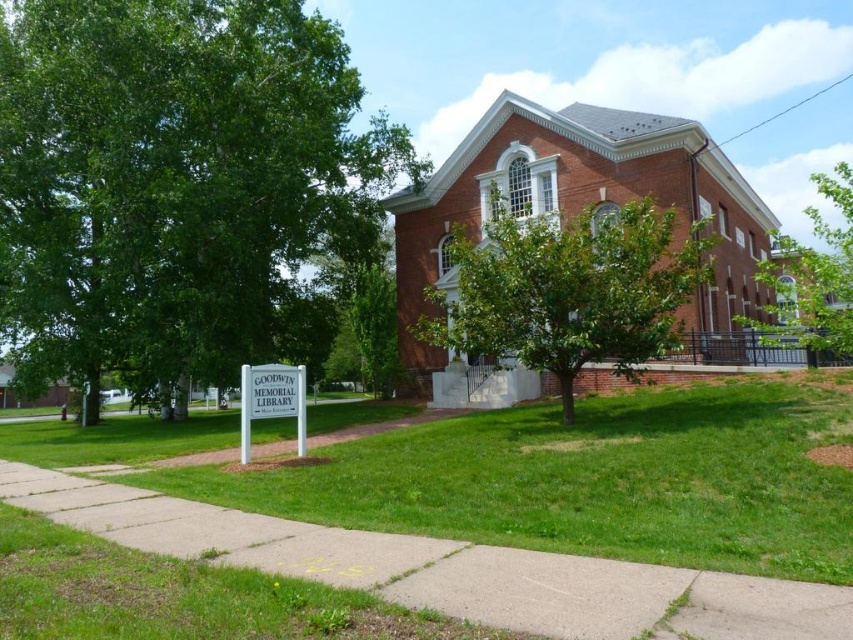
You are standing on the sidewalk in front of the Goodwin Memorial Library. You see the brick church at center and the green leafy tree at upper right. Which object is closer to the left side of the scene?

The brick church at center is positioned on the left side of green leafy tree at upper right, so it is closer to the left side of the scene.

You are a visitor approaching the Goodwin Memorial Library and notice both the green leafy tree at upper right and the white plastic sign at lower left. Which object is closer to you as you stand at the entrance?

The green leafy tree at upper right is closer to you because it is positioned in front of the white plastic sign at lower left, indicating it is nearer to your viewpoint.

Looking at this image, you are a visitor approaching the Goodwin Memorial Library and notice both the green leafy tree at upper right and the white plastic sign at lower left. Which object is higher in height?

The green leafy tree at upper right is taller than the white plastic sign at lower left.